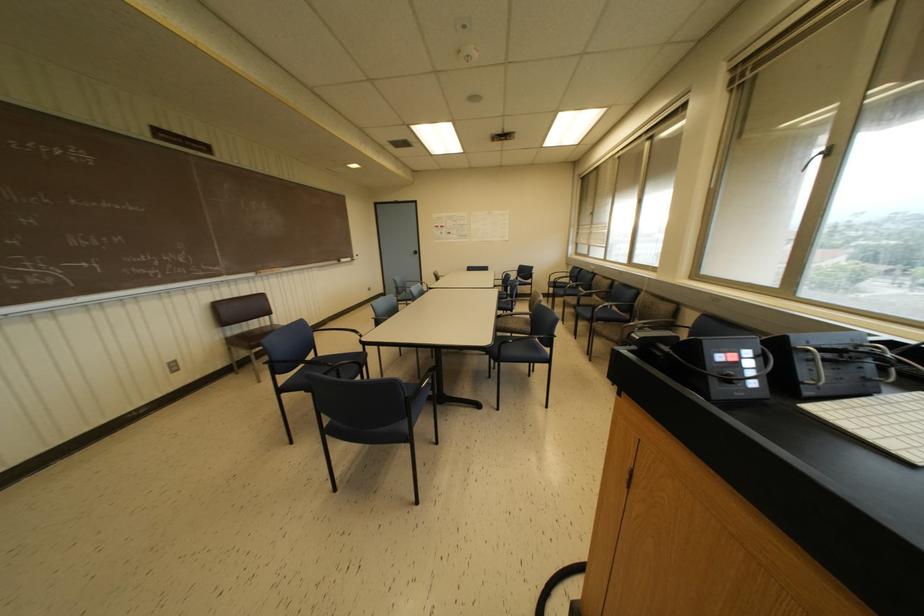
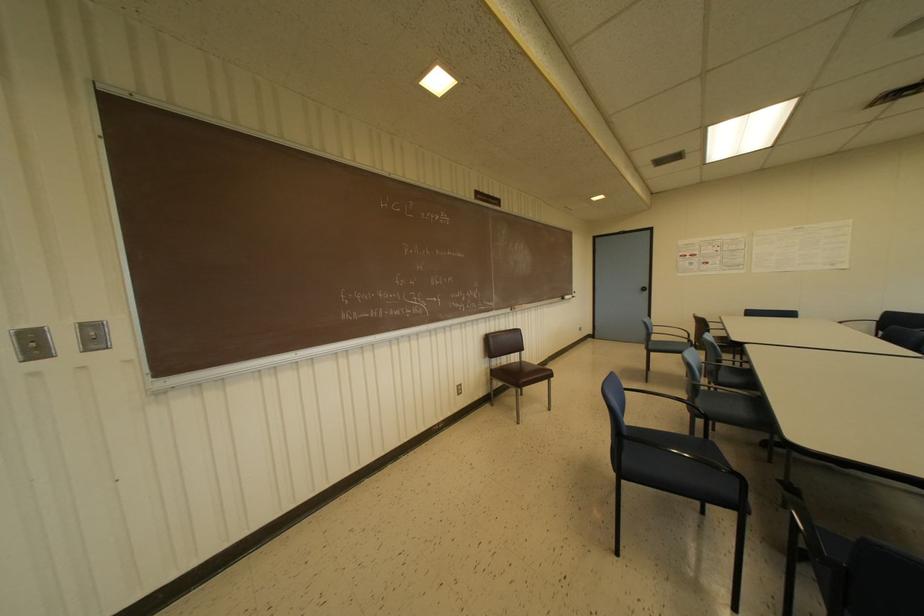
Where in the second image is the point corresponding to point (342, 259) from the first image?

(565, 296)